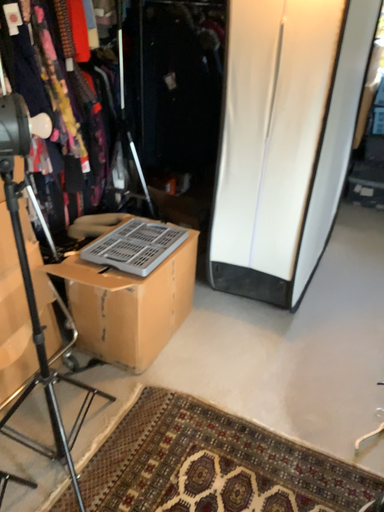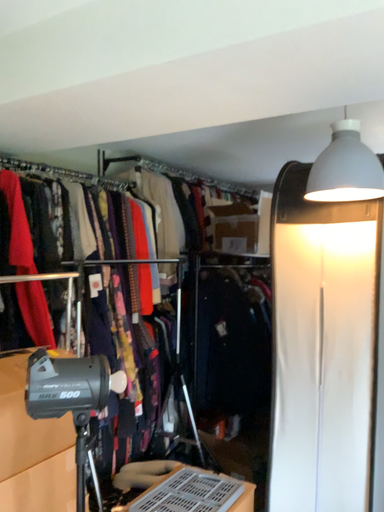
Question: How did the camera likely rotate when shooting the video?

Choices:
 (A) rotated downward
 (B) rotated upward

Answer: (B)